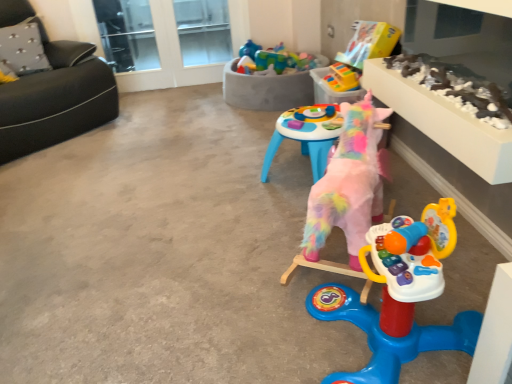
Find the location of a particular element. free spot in front of transparent glass window at upper center is located at coordinates [x=197, y=94].